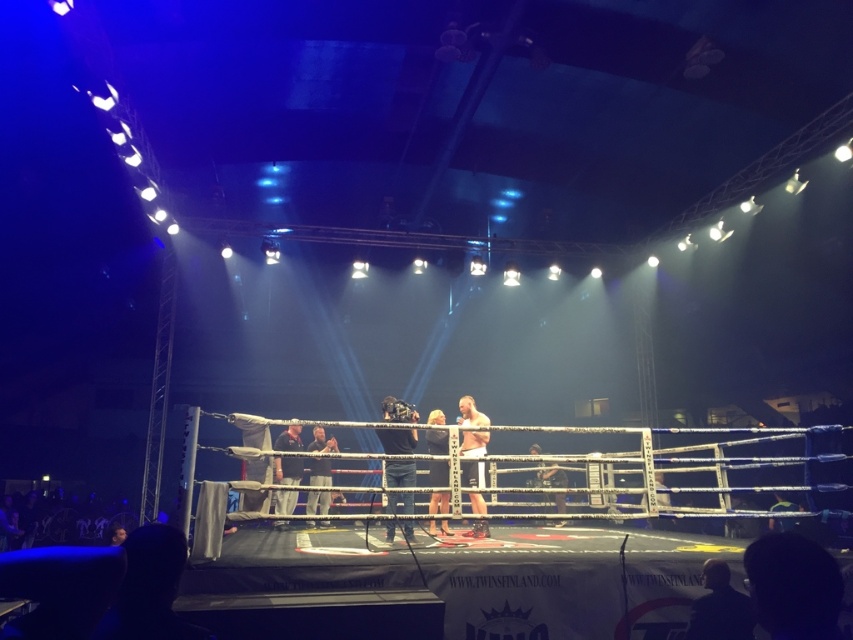
Is smooth white shirt at center positioned in front of smooth skin person at center?

Yes, it is.

Is smooth white shirt at center positioned behind smooth skin person at center?

No, smooth white shirt at center is closer to the viewer.

Locate an element on the screen. smooth white shirt at center is located at coordinates (473, 444).

Is dark gray fabric at center shorter than smooth skin at center?

No.

In order to click on dark gray fabric at center in this screenshot , I will do `click(287, 468)`.

You are a GUI agent. You are given a task and a screenshot of the screen. Output one action in this format:
    pyautogui.click(x=<x>, y=<y>)
    Task: Click on the dark gray fabric at center
    This screenshot has height=640, width=853.
    Given the screenshot: What is the action you would take?
    pyautogui.click(x=287, y=468)

Consider the image. Which is above, dark blue jeans at center or smooth skin person at center?

dark blue jeans at center

Does dark blue jeans at center appear over smooth skin person at center?

Yes, dark blue jeans at center is above smooth skin person at center.

Does point (412, 524) come in front of point (323, 440)?

Yes, point (412, 524) is in front of point (323, 440).

The image size is (853, 640). Find the location of `dark blue jeans at center`. dark blue jeans at center is located at coordinates (397, 440).